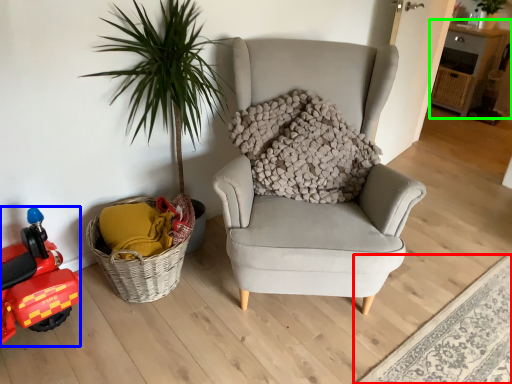
Question: Estimate the real-world distances between objects in this image. Which object is closer to plain (highlighted by a red box), toy car (highlighted by a blue box) or table (highlighted by a green box)?

Choices:
 (A) toy car
 (B) table

Answer: (A)